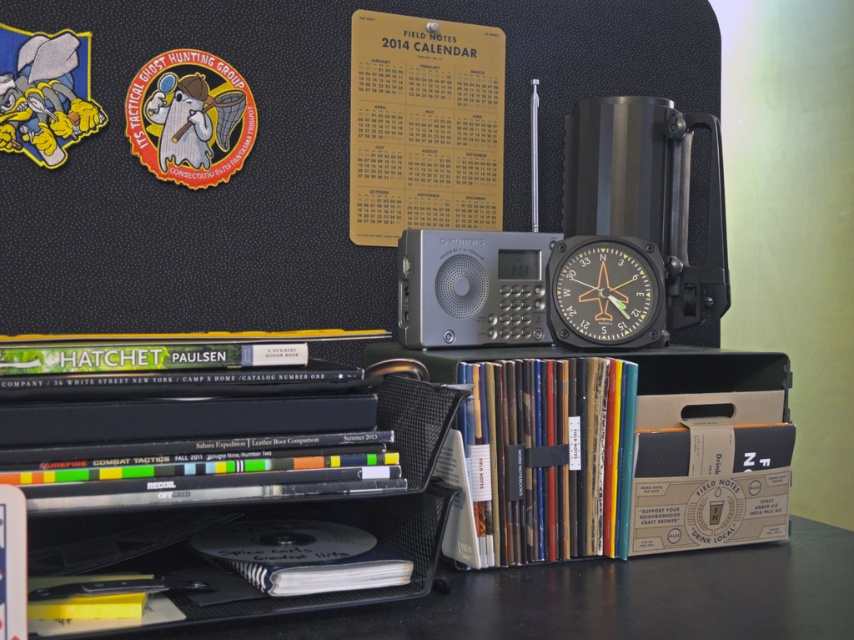
Between cardboard box at center and black mesh organizer at lower left, which one appears on the left side from the viewer's perspective?

black mesh organizer at lower left

Between point (542, 362) and point (431, 630), which one is positioned in front?

Point (431, 630) is in front.

Image resolution: width=854 pixels, height=640 pixels. What do you see at coordinates (623, 445) in the screenshot? I see `cardboard box at center` at bounding box center [623, 445].

Identify the location of cardboard box at center. (623, 445).

Does black mesh organizer at lower left have a larger size compared to matte black compass at center?

Yes, black mesh organizer at lower left is bigger than matte black compass at center.

Is black mesh organizer at lower left smaller than matte black compass at center?

No.

Is point (800, 618) positioned in front of point (623, 298)?

That is True.

Locate an element on the screen. The width and height of the screenshot is (854, 640). black mesh organizer at lower left is located at coordinates (606, 596).

Does cardboard box at center have a smaller size compared to matte black compass at center?

Incorrect, cardboard box at center is not smaller in size than matte black compass at center.

Can you confirm if cardboard box at center is positioned above matte black compass at center?

Incorrect, cardboard box at center is not positioned above matte black compass at center.

Where is `cardboard box at center`? This screenshot has height=640, width=854. cardboard box at center is located at coordinates (623, 445).